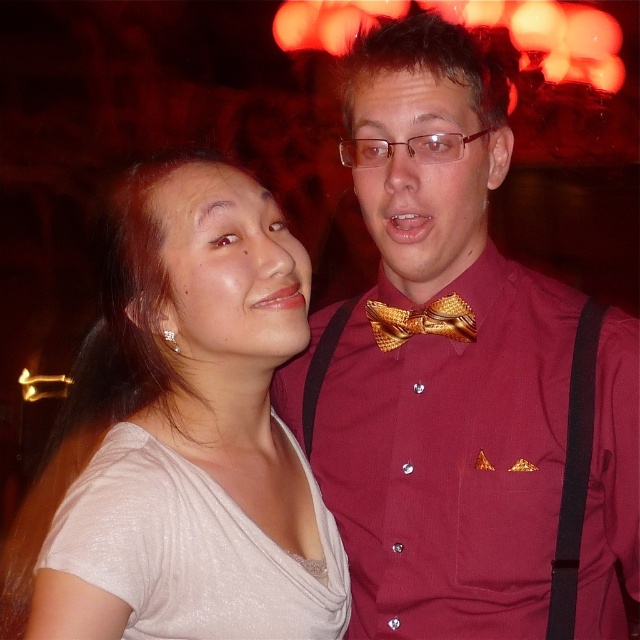
You are at a social event and want to locate the maroon shirt at center. According to the coordinates provided, where would you look to find it?

The maroon shirt at center is located at coordinates point (464, 380).

You are at a social event and see two people standing near you. The woman on the left is wearing a light colored top, and the man on the right has a maroon shirt with a gold bow tie. There is a specific point marked at coordinates (182,435). Can you tell me what object or clothing item is located at that point?

The point at coordinates (182,435) marks the location of the satin beige blouse at left.

Consider the image. You are a photographer adjusting your camera settings to capture a closeup of both the satin beige blouse at left and the satin white dress at lower left. Given their proximity, will you need to adjust the focus to ensure both are in sharp focus simultaneously?

The satin beige blouse at left is only 1.32 inches away from the satin white dress at lower left. Depending on the camera lens and aperture used, if the depth of field is sufficient to cover this small distance, both can be in focus without needing to adjust the focus. However, if the depth of field is narrow, you may need to adjust the focus point to ensure both are sharp.